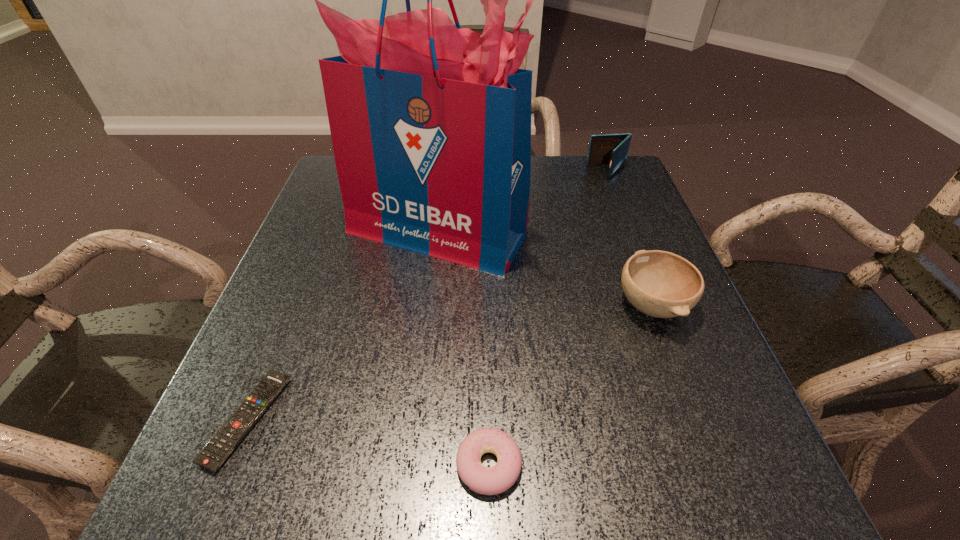
Locate an element on the screen. This screenshot has width=960, height=540. bowl situated at the right edge is located at coordinates (660, 284).

You are a GUI agent. You are given a task and a screenshot of the screen. Output one action in this format:
    pyautogui.click(x=<x>, y=<y>)
    Task: Click on the object that is at the far left corner
    The width and height of the screenshot is (960, 540).
    Given the screenshot: What is the action you would take?
    pyautogui.click(x=430, y=123)

Where is `object that is at the near left corner`? object that is at the near left corner is located at coordinates (215, 453).

I want to click on object that is positioned at the far right corner, so click(x=612, y=149).

In order to click on vacant space at the near edge of the desktop in this screenshot , I will do `click(660, 519)`.

Find the location of `vacant space at the right edge of the desktop`. vacant space at the right edge of the desktop is located at coordinates (659, 346).

Find the location of `vacant space at the far left corner of the desktop`. vacant space at the far left corner of the desktop is located at coordinates (336, 188).

In the image, there is a desktop. Where is `vacant space at the near left corner`? The width and height of the screenshot is (960, 540). vacant space at the near left corner is located at coordinates (188, 503).

The height and width of the screenshot is (540, 960). In the image, there is a desktop. In order to click on free space at the far right corner in this screenshot , I will do `click(581, 202)`.

The width and height of the screenshot is (960, 540). Find the location of `free point between the remote control and the bowl`. free point between the remote control and the bowl is located at coordinates (449, 362).